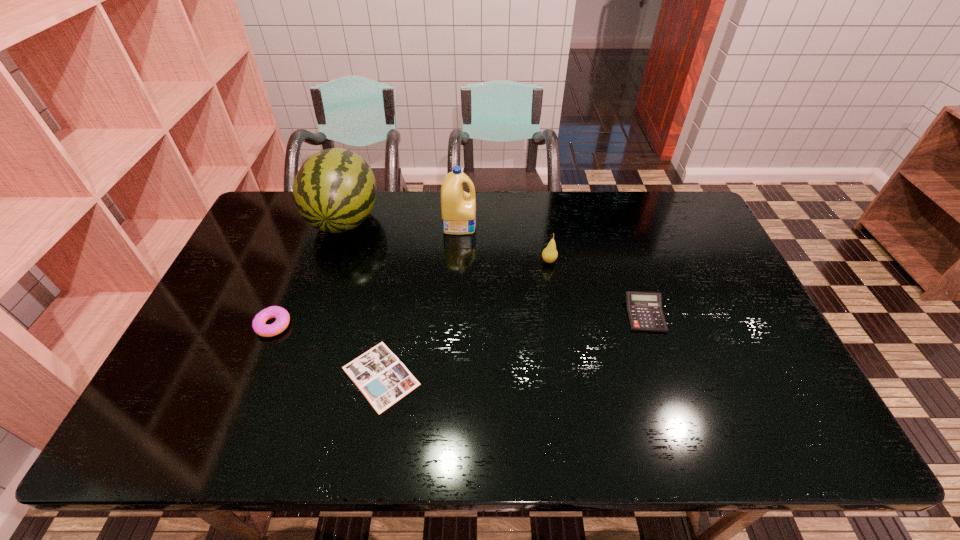
Image resolution: width=960 pixels, height=540 pixels. Find the location of `vacant area between the pear and the book`. vacant area between the pear and the book is located at coordinates click(x=465, y=319).

Image resolution: width=960 pixels, height=540 pixels. I want to click on free space between the book and the doughnut, so click(x=327, y=350).

Find the location of `unoccupied position between the watermelon and the pear`. unoccupied position between the watermelon and the pear is located at coordinates (446, 241).

I want to click on vacant area that lies between the shortest object and the fourth nearest object, so click(x=465, y=319).

Identify which object is the fifth closest to the calculator. Please provide its 2D coordinates. Your answer should be formatted as a tuple, i.e. [(x, y)], where the tuple contains the x and y coordinates of a point satisfying the conditions above.

[(282, 316)]

Identify which object is located as the nearest to the doughnut. Please provide its 2D coordinates. Your answer should be formatted as a tuple, i.e. [(x, y)], where the tuple contains the x and y coordinates of a point satisfying the conditions above.

[(383, 379)]

This screenshot has width=960, height=540. I want to click on blank area in the image that satisfies the following two spatial constraints: 1. on the label of the detergent; 2. on the front side of the book, so click(x=451, y=376).

Locate an element on the screen. This screenshot has width=960, height=540. vacant area in the image that satisfies the following two spatial constraints: 1. on the back side of the rightmost object; 2. on the label of the detergent is located at coordinates (614, 224).

This screenshot has height=540, width=960. What are the coordinates of `free space that satisfies the following two spatial constraints: 1. on the label of the fourth object from left to right; 2. on the right side of the calculator` in the screenshot? It's located at (455, 314).